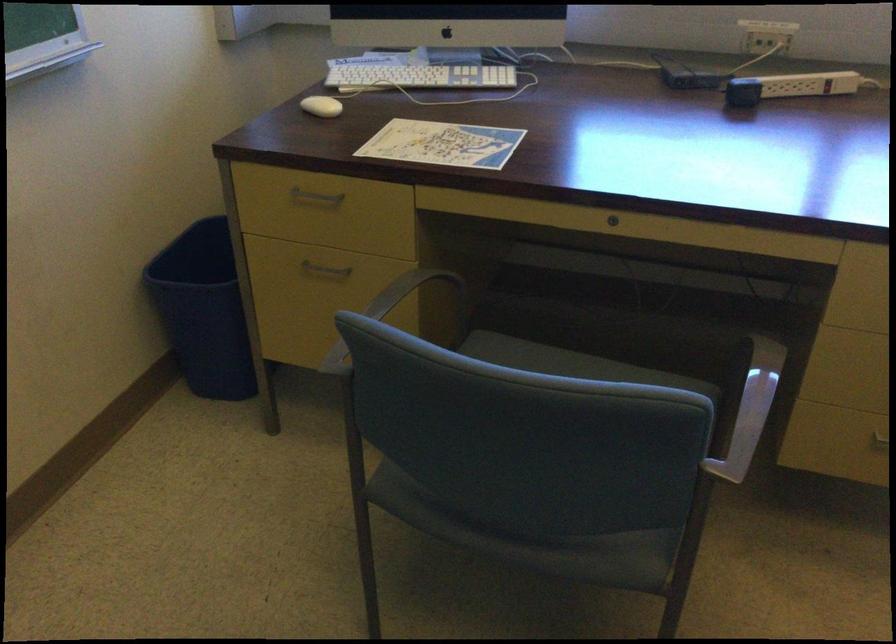
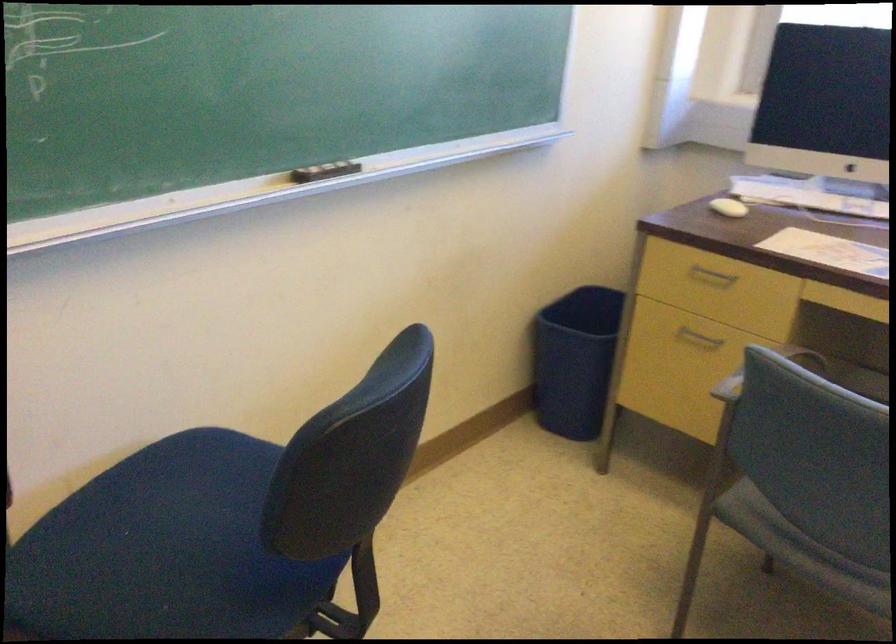
Find the pixel in the second image that matches point 458,518 in the first image.

(800, 549)